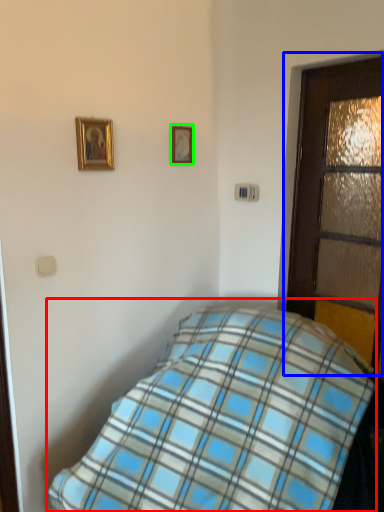
Question: Estimate the real-world distances between objects in this image. Which object is farther from bed (highlighted by a red box), door (highlighted by a blue box) or picture frame (highlighted by a green box)?

Choices:
 (A) door
 (B) picture frame

Answer: (B)